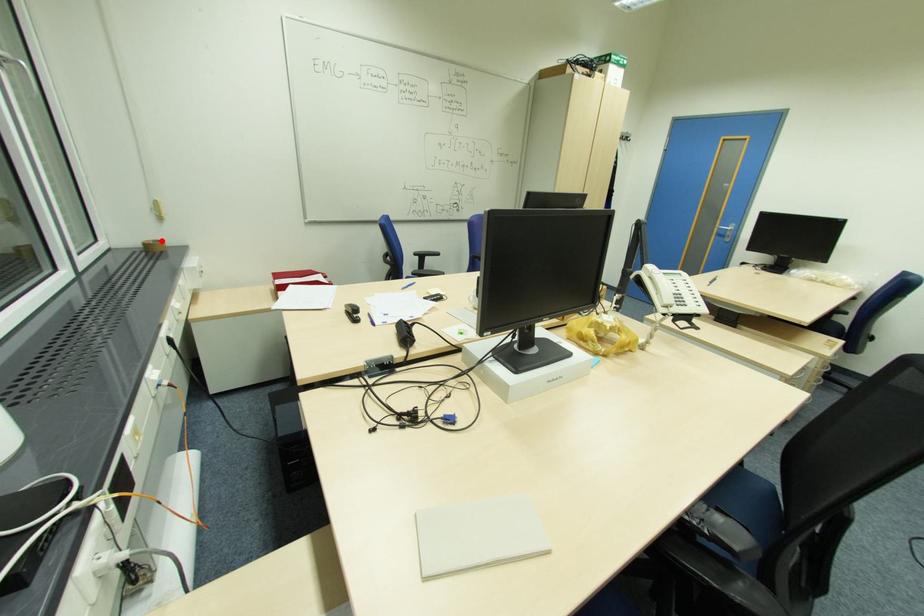
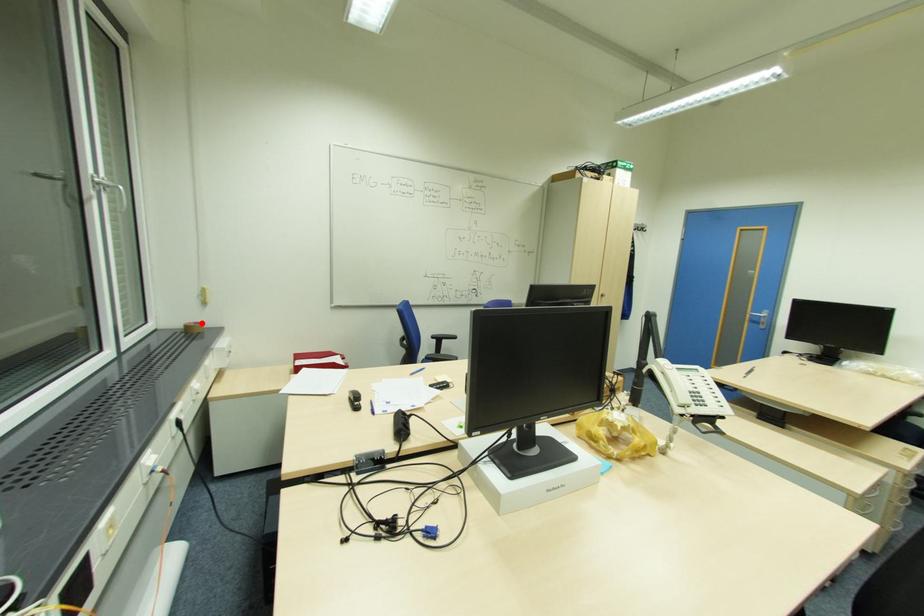
I am providing you with two images of the same scene from different viewpoints. A red point is marked on the first image and another point is marked on the second image. Are the points marked in image1 and image2 representing the same 3D position?

Yes